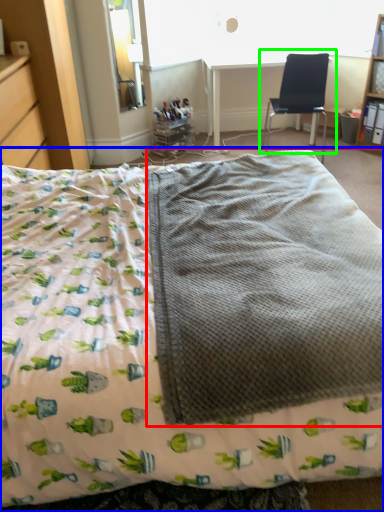
Question: Considering the real-world distances, which object is farthest from blanket (highlighted by a red box)? bed (highlighted by a blue box) or chair (highlighted by a green box)?

Choices:
 (A) bed
 (B) chair

Answer: (B)